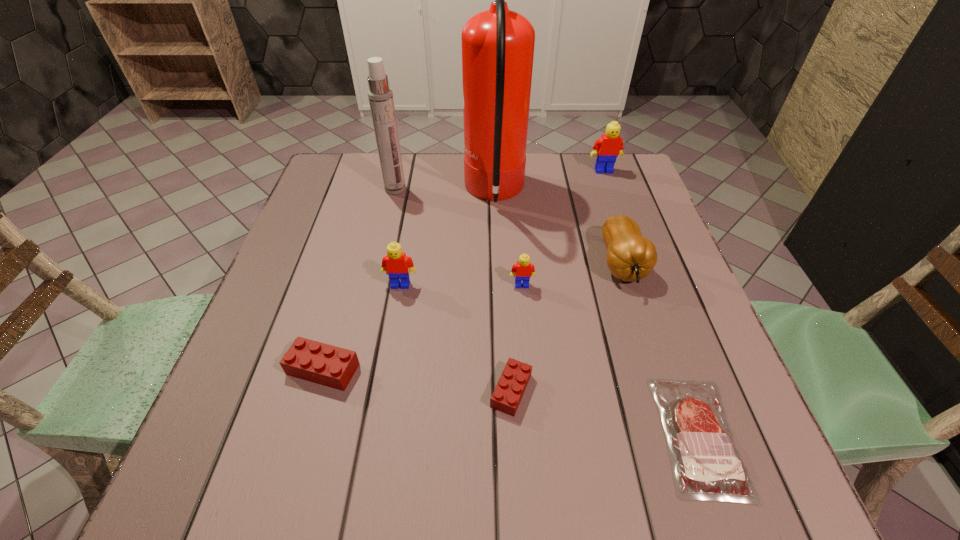
Where is `free spot between the steak and the second Lego from left to right`? free spot between the steak and the second Lego from left to right is located at coordinates (550, 360).

Image resolution: width=960 pixels, height=540 pixels. Identify the location of free spot between the third shortest Lego and the red fire extinguisher. (508, 239).

The height and width of the screenshot is (540, 960). Find the location of `object that stands as the closest to the steak`. object that stands as the closest to the steak is located at coordinates (630, 257).

Choose which object is the second nearest neighbor to the eighth tallest object. Please provide its 2D coordinates. Your answer should be formatted as a tuple, i.e. [(x, y)], where the tuple contains the x and y coordinates of a point satisfying the conditions above.

[(705, 461)]

Point out which Lego is positioned as the fifth nearest to the shortest object. Please provide its 2D coordinates. Your answer should be formatted as a tuple, i.e. [(x, y)], where the tuple contains the x and y coordinates of a point satisfying the conditions above.

[(607, 148)]

What are the coordinates of `Lego that stands as the third closest to the fire extinguisher` in the screenshot? It's located at (396, 264).

This screenshot has width=960, height=540. Identify the location of yellow Lego that is the third closest to the leftmost Lego. (607, 148).

Select which yellow Lego appears as the third closest to the fire extinguisher. Please provide its 2D coordinates. Your answer should be formatted as a tuple, i.e. [(x, y)], where the tuple contains the x and y coordinates of a point satisfying the conditions above.

[(396, 264)]

In order to click on free spot that satisfies the following two spatial constraints: 1. on the front-facing side of the farthest yellow Lego; 2. on the right side of the shortest object in this screenshot , I will do `click(697, 435)`.

Locate an element on the screen. This screenshot has height=540, width=960. free space that satisfies the following two spatial constraints: 1. on the front-facing side of the steak; 2. on the right side of the leftmost yellow Lego is located at coordinates (374, 435).